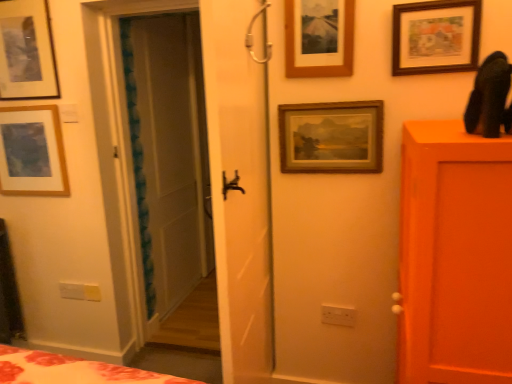
Question: Is point (346, 48) positioned closer to the camera than point (330, 130)?

Choices:
 (A) closer
 (B) farther

Answer: (A)

Question: Would you say wooden picture frame at upper center, which is the third picture frame in left-to-right order, is to the left or to the right of wooden framed painting at center, marked as the fourth picture frame in a left-to-right arrangement, in the picture?

Choices:
 (A) right
 (B) left

Answer: (B)

Question: Estimate the real-world distances between objects in this image. Which object is farther from the wooden framed painting at center, marked as the fourth picture frame in a left-to-right arrangement?

Choices:
 (A) matte wooden picture frame at upper left, the 1th picture frame from the left
 (B) wooden picture frame at upper center, which is counted as the third picture frame, starting from the right
 (C) matte black picture frame at upper left, the fourth picture frame from the right
 (D) white plastic light switch at lower left
 (E) white plastic electric outlet at lower center

Answer: (D)

Question: Based on their relative distances, which object is nearer to the wooden picture frame at upper center, which is the third picture frame in left-to-right order?

Choices:
 (A) white plastic light switch at lower left
 (B) wooden framed painting at center, marked as the fourth picture frame in a left-to-right arrangement
 (C) white plastic electric outlet at lower center
 (D) wooden picture frame at upper right, which is counted as the 1th picture frame, starting from the right
 (E) matte wooden picture frame at upper left, which ranks as the 5th picture frame in right-to-left order

Answer: (B)